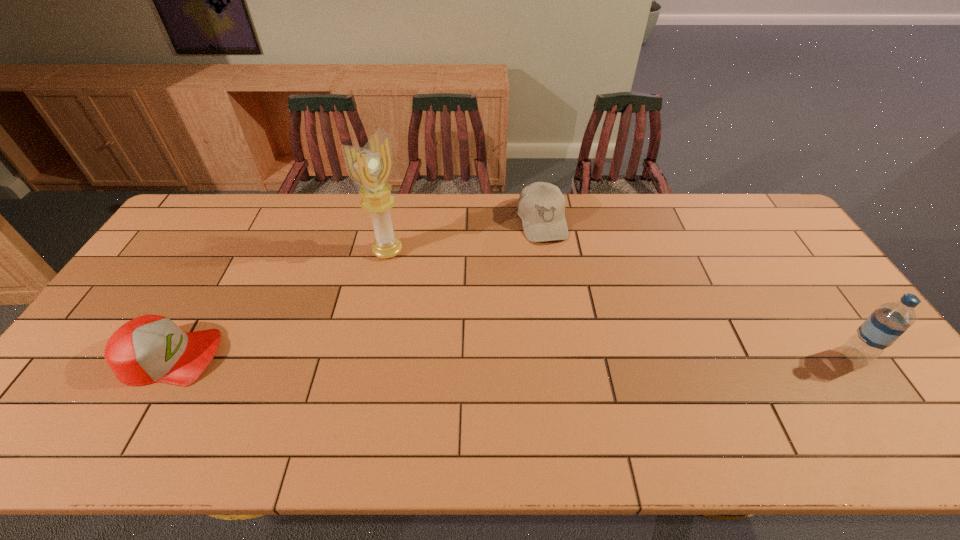
Where is `free spot on the desktop that is between the left baseball cap and the rightmost object and is positioned on the front-facing side of the tallest object`? free spot on the desktop that is between the left baseball cap and the rightmost object and is positioned on the front-facing side of the tallest object is located at coordinates (538, 356).

Locate an element on the screen. vacant space on the desktop that is between the leftmost object and the third shortest object and is positioned on the front-facing side of the right baseball cap is located at coordinates (585, 356).